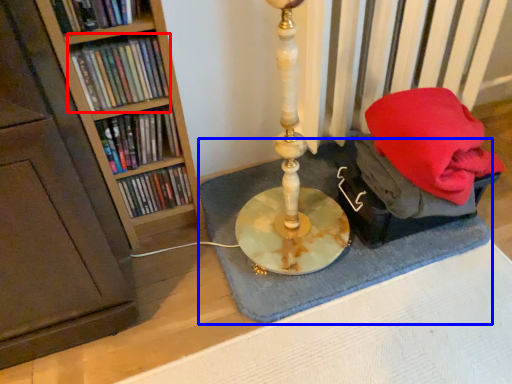
Question: Among these objects, which one is farthest to the camera, book (highlighted by a red box) or bath mat (highlighted by a blue box)?

Choices:
 (A) book
 (B) bath mat

Answer: (B)